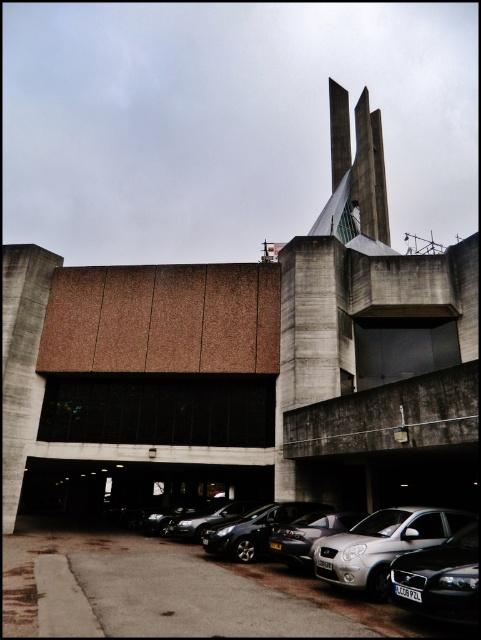
Does silver metallic hatchback at lower center appear on the right side of silver metallic hatchback at center?

In fact, silver metallic hatchback at lower center is to the left of silver metallic hatchback at center.

Does silver metallic hatchback at lower center appear on the left side of silver metallic hatchback at center?

Correct, you'll find silver metallic hatchback at lower center to the left of silver metallic hatchback at center.

Which is behind, point (313, 582) or point (205, 531)?

The point (205, 531) is more distant.

You are a GUI agent. You are given a task and a screenshot of the screen. Output one action in this format:
    pyautogui.click(x=<x>, y=<y>)
    Task: Click on the silver metallic hatchback at lower center
    The image size is (481, 640).
    Given the screenshot: What is the action you would take?
    pyautogui.click(x=253, y=589)

How much distance is there between silver metallic hatchback at center and shiny silver car at center?

4.56 meters

Based on the photo, does silver metallic hatchback at center appear on the right side of shiny silver car at center?

Indeed, silver metallic hatchback at center is positioned on the right side of shiny silver car at center.

Image resolution: width=481 pixels, height=640 pixels. Identify the location of silver metallic hatchback at center. (254, 529).

Is point (187, 589) more distant than point (340, 529)?

No, (187, 589) is in front of (340, 529).

Which is below, silver metallic hatchback at lower center or silver metallic sedan at center?

silver metallic hatchback at lower center is below.

Find the location of `silver metallic hatchback at lower center`. silver metallic hatchback at lower center is located at coordinates (253, 589).

Find the location of a particular element. The width and height of the screenshot is (481, 640). silver metallic hatchback at lower center is located at coordinates (253, 589).